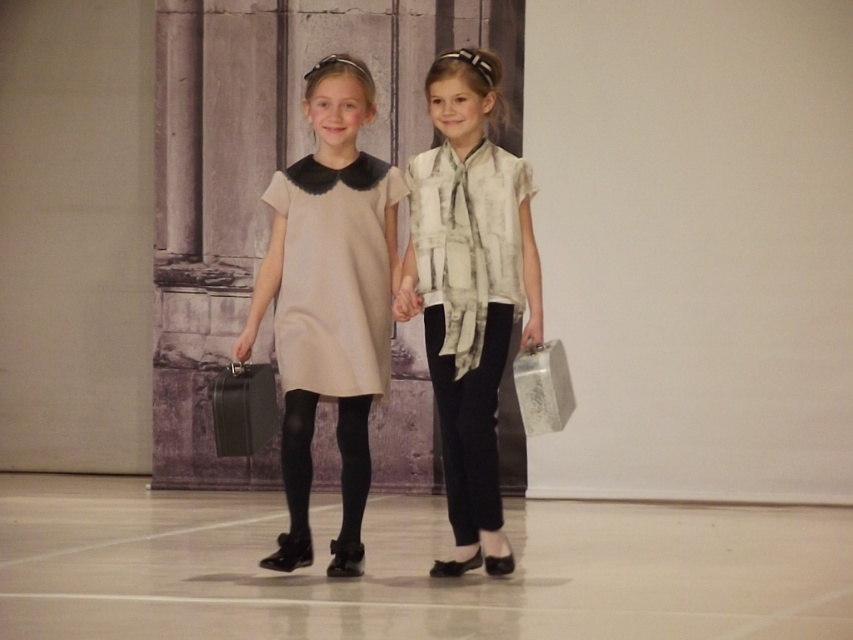
Does white printed blouse at center appear on the right side of metallic silver briefcase at right?

In fact, white printed blouse at center is to the left of metallic silver briefcase at right.

At what (x,y) coordinates should I click in order to perform the action: click on white printed blouse at center. Please return your answer as a coordinate pair (x, y). The height and width of the screenshot is (640, 853). Looking at the image, I should click on (469, 291).

Identify the location of white printed blouse at center. This screenshot has width=853, height=640. (469, 291).

Which is in front, point (451, 310) or point (245, 368)?

Point (451, 310) is more forward.

How distant is white printed blouse at center from metallic briefcase at center?

The distance of white printed blouse at center from metallic briefcase at center is 1.36 meters.

Does point (477, 209) come in front of point (260, 369)?

Yes, it is in front of point (260, 369).

Where is `white printed blouse at center`? This screenshot has width=853, height=640. white printed blouse at center is located at coordinates (469, 291).

Does matte beige dress at center come in front of metallic briefcase at center?

No, it is not.

Can you confirm if matte beige dress at center is positioned above metallic briefcase at center?

Yes, matte beige dress at center is above metallic briefcase at center.

Find the location of `matte beige dress at center`. matte beige dress at center is located at coordinates (329, 300).